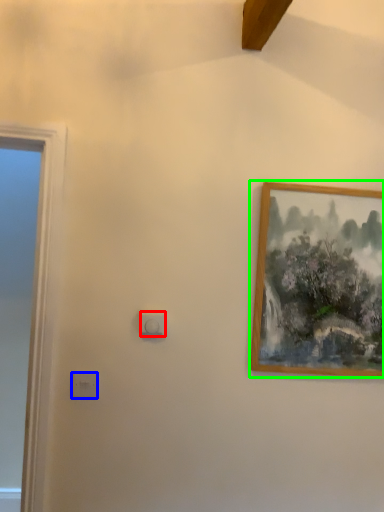
Question: Estimate the real-world distances between objects in this image. Which object is closer to light switch (highlighted by a red box), light switch (highlighted by a blue box) or picture frame (highlighted by a green box)?

Choices:
 (A) light switch
 (B) picture frame

Answer: (A)